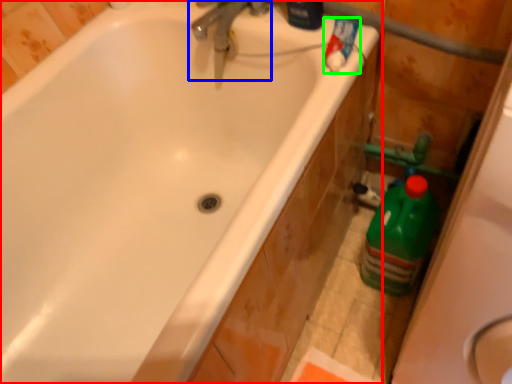
Question: Which is nearer to the bathtub (highlighted by a red box)? tap (highlighted by a blue box) or cleaning product (highlighted by a green box).

Choices:
 (A) tap
 (B) cleaning product

Answer: (A)